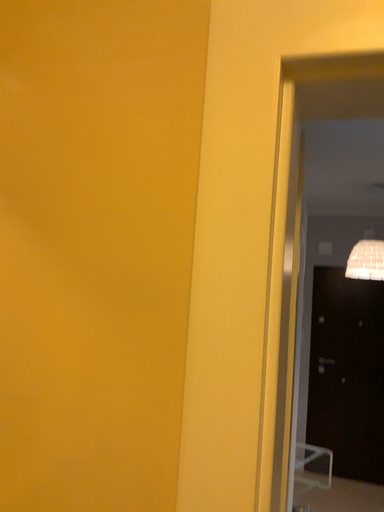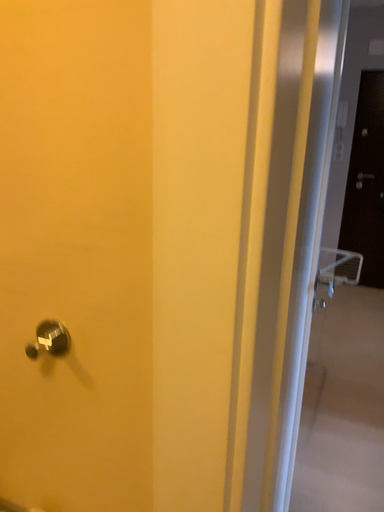
Question: Which way did the camera rotate in the video?

Choices:
 (A) rotated downward
 (B) rotated upward

Answer: (A)